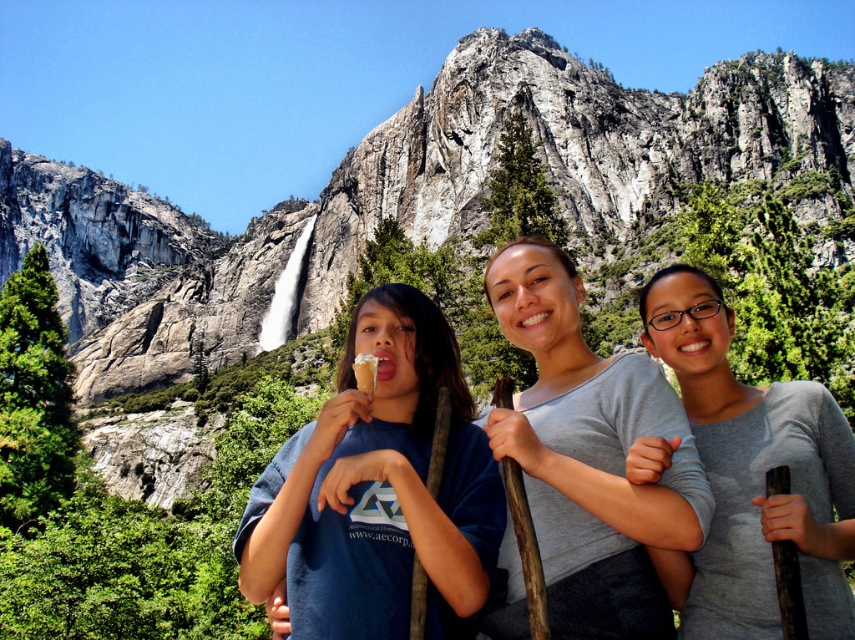
Can you confirm if blue cotton shirt at center is thinner than gray matte shirt at center?

No.

Which of these two, blue cotton shirt at center or gray matte shirt at center, stands shorter?

blue cotton shirt at center

Is point (411, 312) more distant than point (718, 356)?

Yes, point (411, 312) is farther from viewer.

This screenshot has width=855, height=640. I want to click on blue cotton shirt at center, so click(x=378, y=490).

Which is more to the left, gray cotton shirt at center or vanilla ice cream cone at center?

Positioned to the left is vanilla ice cream cone at center.

Does gray cotton shirt at center have a greater width compared to vanilla ice cream cone at center?

Indeed, gray cotton shirt at center has a greater width compared to vanilla ice cream cone at center.

Looking at this image, who is more distant from viewer, (543, 362) or (357, 387)?

The point (543, 362) is more distant.

The height and width of the screenshot is (640, 855). What are the coordinates of `gray cotton shirt at center` in the screenshot? It's located at (588, 454).

Who is taller, gray matte shirt at center or vanilla ice cream cone at center?

gray matte shirt at center is taller.

Is gray matte shirt at center behind vanilla ice cream cone at center?

No, gray matte shirt at center is in front of vanilla ice cream cone at center.

Between point (729, 570) and point (370, 397), which one is positioned in front?

Point (729, 570) is more forward.

You are a GUI agent. You are given a task and a screenshot of the screen. Output one action in this format:
    pyautogui.click(x=<x>, y=<y>)
    Task: Click on the gray matte shirt at center
    The width and height of the screenshot is (855, 640).
    Given the screenshot: What is the action you would take?
    pyautogui.click(x=752, y=476)